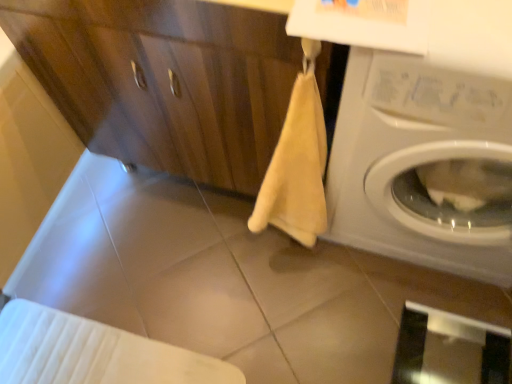
You are a GUI agent. You are given a task and a screenshot of the screen. Output one action in this format:
    pyautogui.click(x=<x>, y=<y>)
    Task: Click on the vacant space in front of beige matte tile at center
    
    Given the screenshot: What is the action you would take?
    click(229, 351)